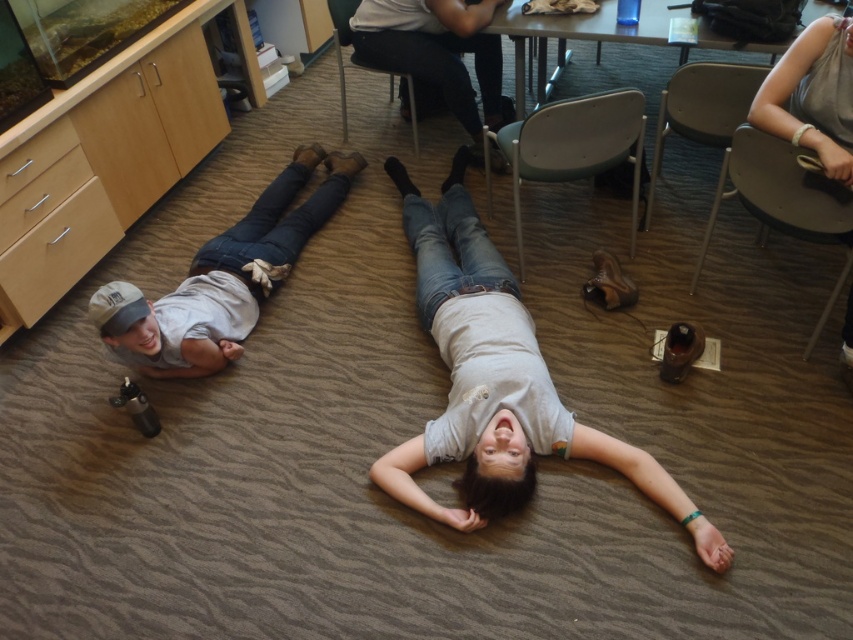
Based on the photo, can you confirm if gray fabric purse at upper right is positioned to the right of metallic gray table at upper center?

Yes, gray fabric purse at upper right is to the right of metallic gray table at upper center.

Between gray fabric purse at upper right and metallic gray table at upper center, which one has less height?

With less height is gray fabric purse at upper right.

Find the location of a particular element. gray fabric purse at upper right is located at coordinates (811, 96).

Find the location of a particular element. The height and width of the screenshot is (640, 853). gray fabric purse at upper right is located at coordinates (811, 96).

Between point (735, 140) and point (666, 118), which one is positioned in front?

Point (735, 140)

Is metallic silver chair at upper right to the left of metallic gray chair at upper right from the viewer's perspective?

No, metallic silver chair at upper right is not to the left of metallic gray chair at upper right.

Locate an element on the screen. This screenshot has width=853, height=640. metallic silver chair at upper right is located at coordinates (782, 200).

Can you confirm if dark gray jeans at center is positioned above metallic gray chair at center?

Indeed, dark gray jeans at center is positioned over metallic gray chair at center.

In the scene shown: Does dark gray jeans at center have a greater width compared to metallic gray chair at center?

Indeed, dark gray jeans at center has a greater width compared to metallic gray chair at center.

Which is in front, point (403, 20) or point (639, 147)?

Positioned in front is point (639, 147).

This screenshot has width=853, height=640. What are the coordinates of `dark gray jeans at center` in the screenshot? It's located at (437, 52).